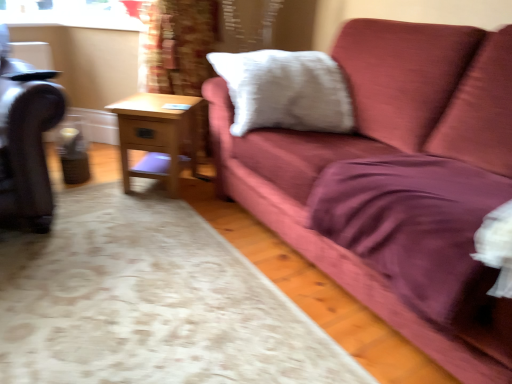
Question: Could leather swivel chair at left be considered to be inside wooden side table at center?

Choices:
 (A) yes
 (B) no

Answer: (B)

Question: Is wooden side table at center smaller than leather swivel chair at left?

Choices:
 (A) no
 (B) yes

Answer: (B)

Question: Is wooden side table at center to the right of leather swivel chair at left from the viewer's perspective?

Choices:
 (A) yes
 (B) no

Answer: (A)

Question: Would you consider wooden side table at center to be distant from leather swivel chair at left?

Choices:
 (A) yes
 (B) no

Answer: (B)

Question: Is wooden side table at center located outside leather swivel chair at left?

Choices:
 (A) no
 (B) yes

Answer: (B)

Question: In the image, is wooden side table at center positioned in front of or behind white soft pillow at upper center?

Choices:
 (A) front
 (B) behind

Answer: (B)

Question: From the image's perspective, is wooden side table at center above or below white soft pillow at upper center?

Choices:
 (A) below
 (B) above

Answer: (A)

Question: Is wooden side table at center taller or shorter than white soft pillow at upper center?

Choices:
 (A) short
 (B) tall

Answer: (A)

Question: Based on their sizes in the image, would you say wooden side table at center is bigger or smaller than white soft pillow at upper center?

Choices:
 (A) big
 (B) small

Answer: (B)

Question: In terms of height, does white soft pillow at upper center look taller or shorter compared to leather swivel chair at left?

Choices:
 (A) short
 (B) tall

Answer: (A)

Question: Based on their sizes in the image, would you say white soft pillow at upper center is bigger or smaller than leather swivel chair at left?

Choices:
 (A) big
 (B) small

Answer: (B)

Question: Would you say white soft pillow at upper center is inside or outside leather swivel chair at left?

Choices:
 (A) inside
 (B) outside

Answer: (B)

Question: Is point (236, 115) closer or farther from the camera than point (15, 193)?

Choices:
 (A) farther
 (B) closer

Answer: (A)

Question: In terms of height, does wooden side table at center look taller or shorter compared to leather swivel chair at left?

Choices:
 (A) tall
 (B) short

Answer: (B)

Question: Considering the positions of wooden side table at center and leather swivel chair at left in the image, is wooden side table at center bigger or smaller than leather swivel chair at left?

Choices:
 (A) small
 (B) big

Answer: (A)